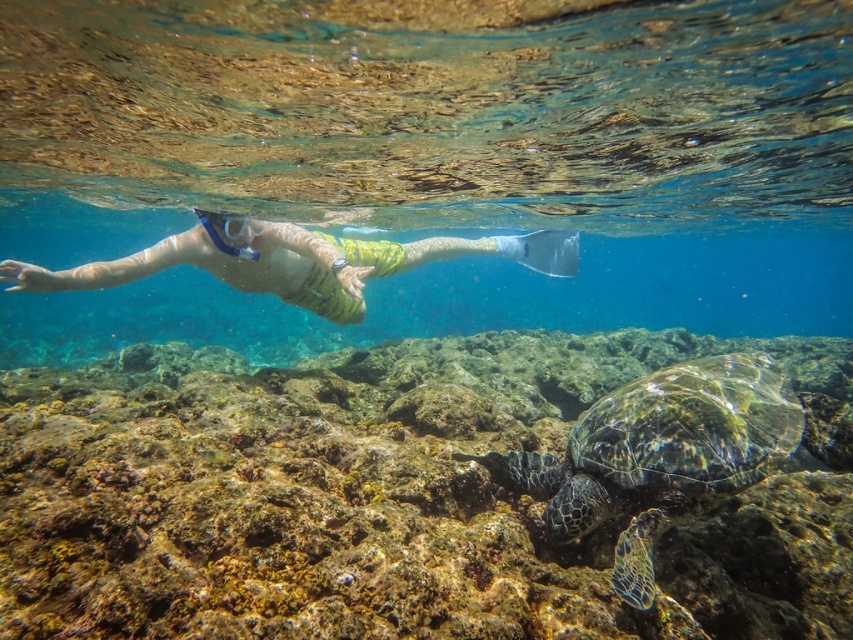
From the picture: You are the snorkeler in the image. You notice the green rough coral reef at center and the transparent rubber snorkel at center. Which object is closer to your face?

The green rough coral reef at center is closer to your face because it is positioned in front of the transparent rubber snorkel at center.

You are a marine biologist observing the underwater scene. You notice the green rough coral reef at center and the transparent rubber snorkel at center. Which object is taller in this scene?

The green rough coral reef at center is much taller than the transparent rubber snorkel at center.